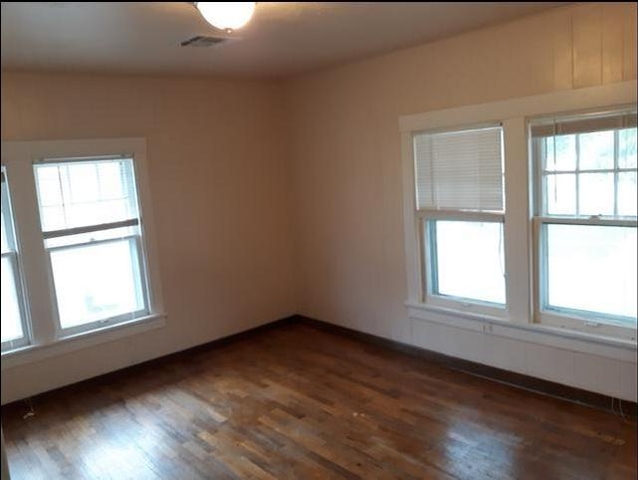
You are a GUI agent. You are given a task and a screenshot of the screen. Output one action in this format:
    pyautogui.click(x=<x>, y=<y>)
    Task: Click on the shiny wood floor
    This screenshot has width=638, height=480.
    Given the screenshot: What is the action you would take?
    pyautogui.click(x=346, y=435)